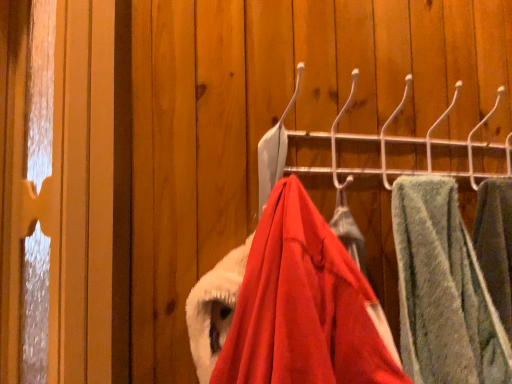
Question: From a real-world perspective, is metallic hook rack at center, which ranks as the 1th closet in top-to-bottom order, physically located above or below velvet red coat at center, the 1th closet positioned from the bottom?

Choices:
 (A) above
 (B) below

Answer: (A)

Question: Relative to velvet red coat at center, the 1th closet positioned from the bottom, is metallic hook rack at center, which ranks as the second closet in bottom-to-top order, in front or behind?

Choices:
 (A) front
 (B) behind

Answer: (B)

Question: Estimate the real-world distances between objects in this image. Which object is closer to the velvet red coat at center, which is the 2th closet in top-to-bottom order?

Choices:
 (A) green fuzzy towel at right
 (B) metallic hook rack at center, which ranks as the 1th closet in top-to-bottom order

Answer: (B)

Question: Which object is positioned closest to the green fuzzy towel at right?

Choices:
 (A) metallic hook rack at center, which ranks as the 1th closet in top-to-bottom order
 (B) velvet red coat at center, the 1th closet positioned from the bottom

Answer: (A)